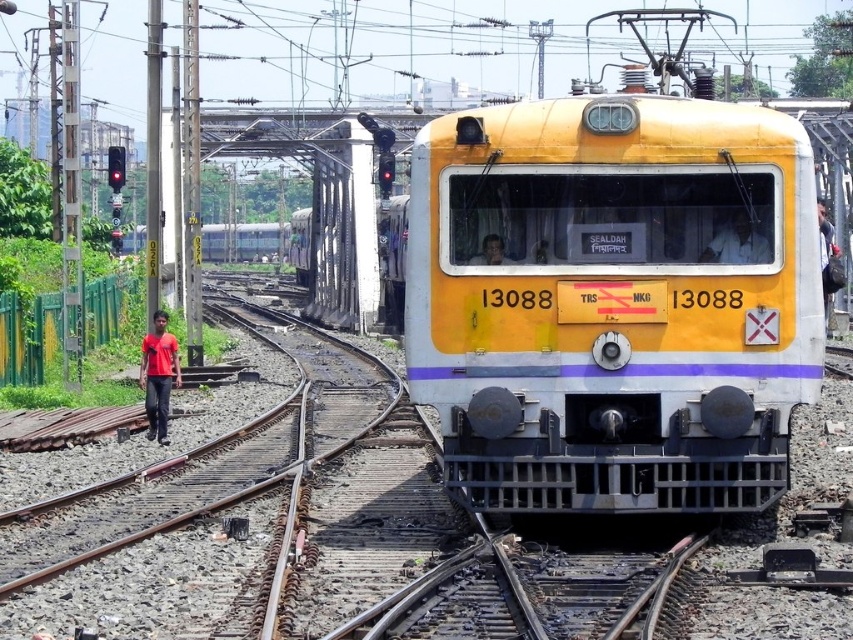
You are standing at the center of the image and want to find the red matte shirt at left. In which direction should you look to see it?

The red matte shirt at left is located at point [158,376], so you should look to the left side of the image.

You are a photographer taking a photo of the train scene. You notice two shirts in the image, a red matte shirt at left and a white fabric shirt at center. Which shirt appears larger in the photo?

The red matte shirt at left appears larger because it is much taller than the white fabric shirt at center.

You are a passenger on the yellow and white train at the forefront. You look out the window and see a person standing between the tracks. You notice the white fabric shirt at center and the matte black face at center. Which object is bigger?

The white fabric shirt at center is larger in size than the matte black face at center.